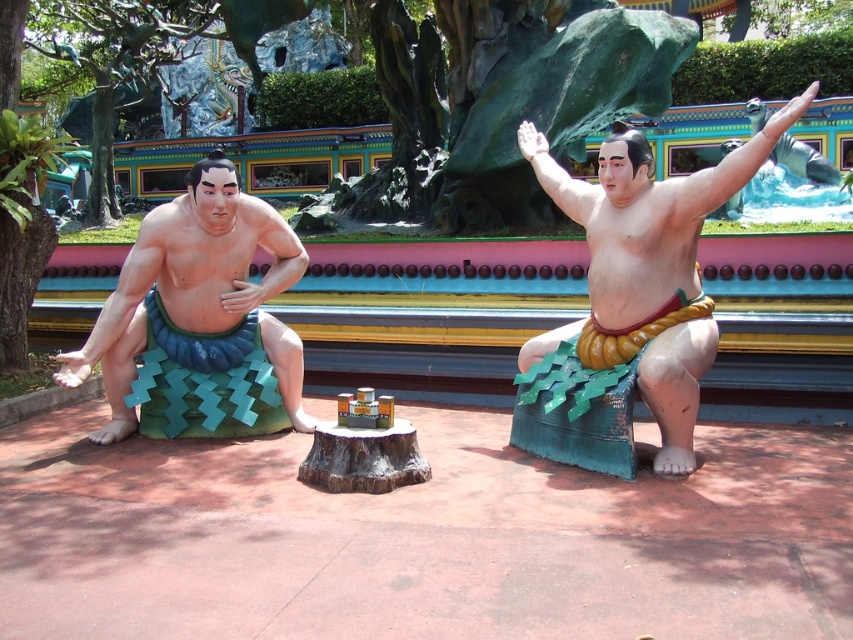
You are a maintenance worker inspecting the statues and notice two areas of concern marked as matte green fabric at left and matte green fabric at center. Which area is directly below the other?

→ The matte green fabric at left is positioned under the matte green fabric at center, meaning the matte green fabric at left is directly below the matte green fabric at center.